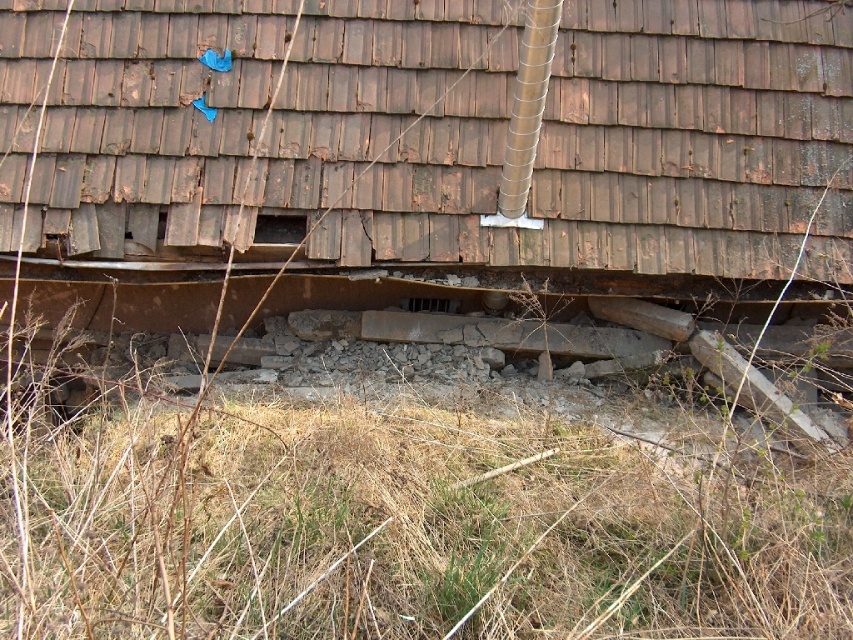
Question: Does weathered wood shingles at center have a smaller size compared to brown dry grass at lower center?

Choices:
 (A) yes
 (B) no

Answer: (A)

Question: Which of the following is the closest to the observer?

Choices:
 (A) brown dry grass at lower center
 (B) weathered wood shingles at center

Answer: (A)

Question: In this image, where is weathered wood shingles at center located relative to brown dry grass at lower center?

Choices:
 (A) right
 (B) left

Answer: (A)

Question: Is weathered wood shingles at center thinner than brown dry grass at lower center?

Choices:
 (A) no
 (B) yes

Answer: (B)